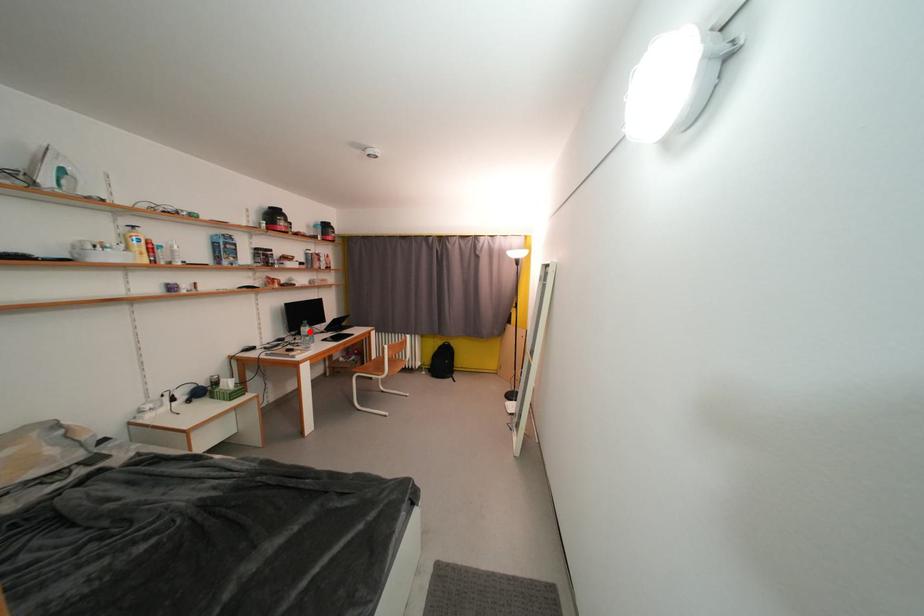
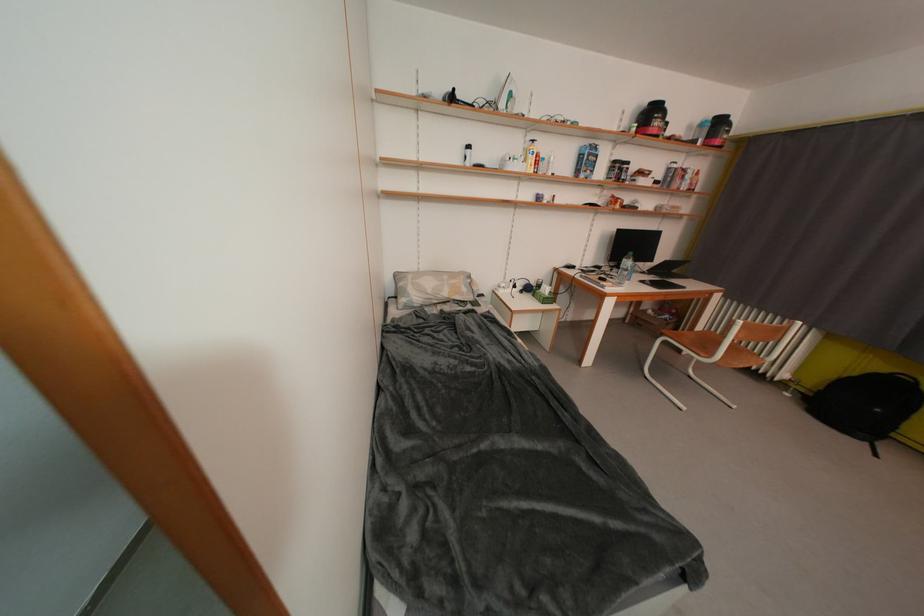
Find the pixel in the second image that matches the highlighted location in the first image.

(631, 262)